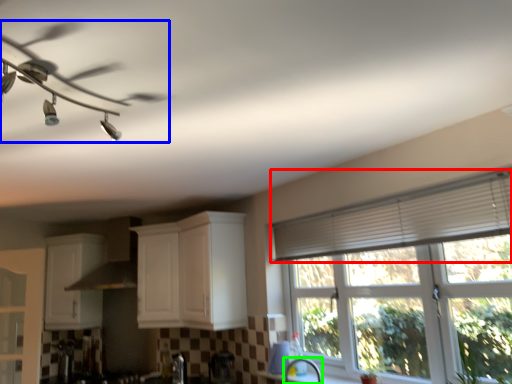
Question: Based on their relative distances, which object is nearer to shutter (highlighted by a red box)? Choose from ceiling fan (highlighted by a blue box) and faucet (highlighted by a green box).

Choices:
 (A) ceiling fan
 (B) faucet

Answer: (B)